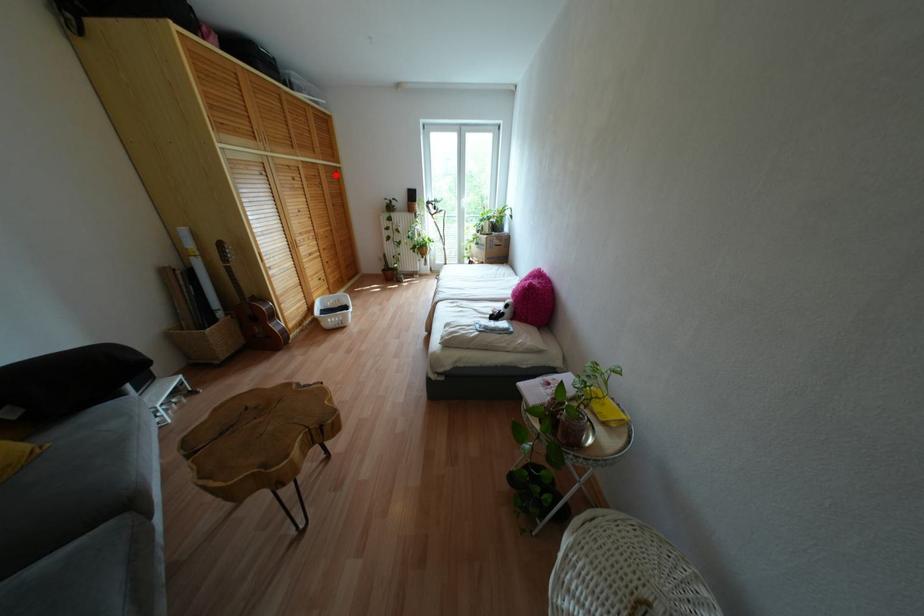
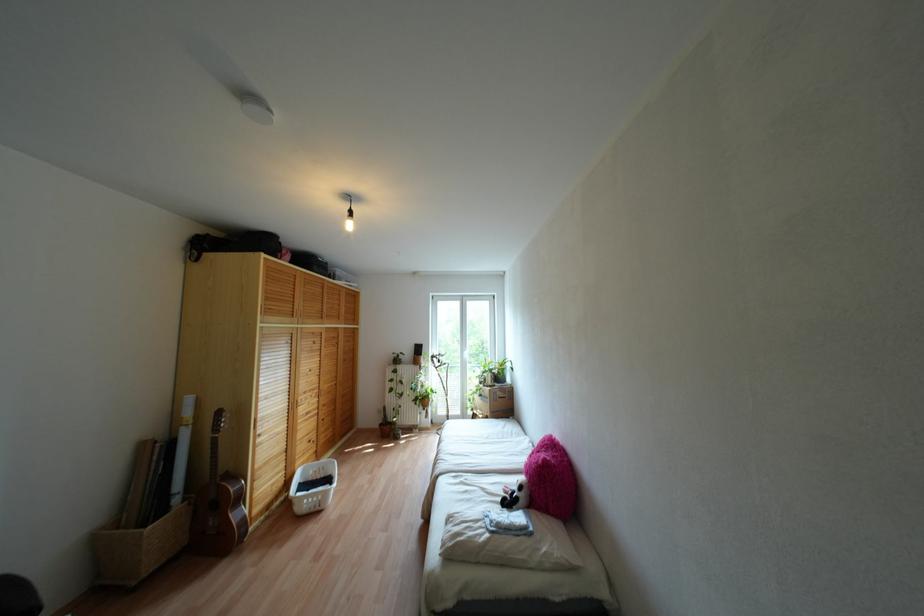
Where in the second image is the point corresponding to the highlighted location from the first image?

(351, 334)